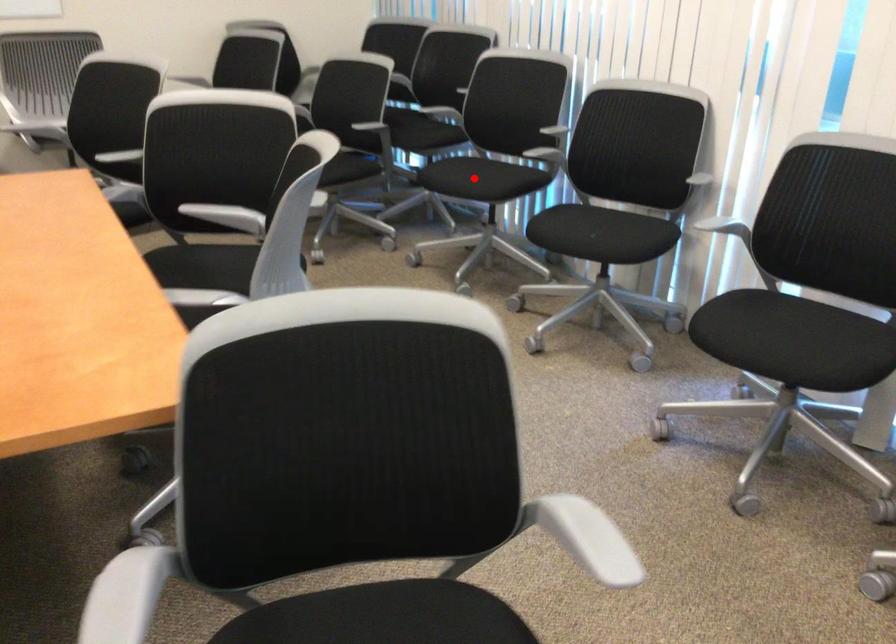
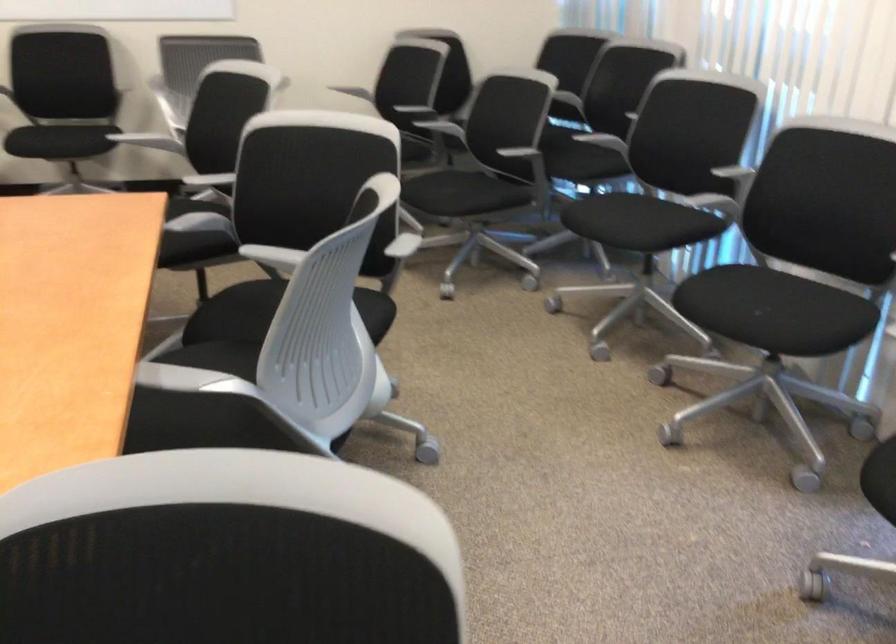
The point at the highlighted location is marked in the first image. Where is the corresponding point in the second image?

(624, 221)